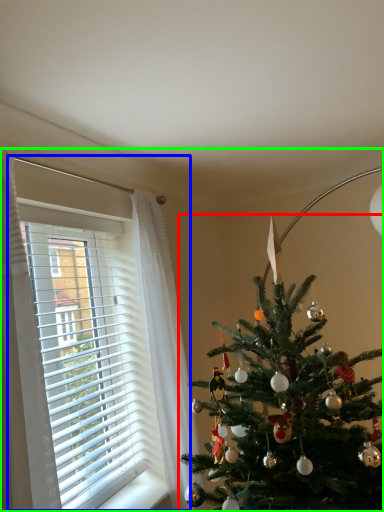
Question: Which is nearer to the christmas tree (highlighted by a red box)? window (highlighted by a blue box) or christmas eve (highlighted by a green box).

Choices:
 (A) window
 (B) christmas eve

Answer: (A)